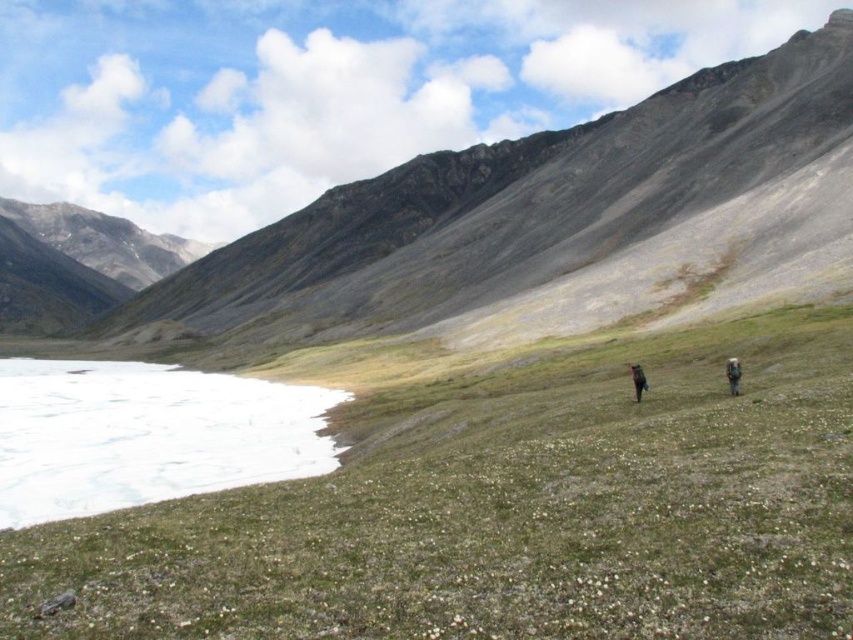
Question: Can you confirm if dark gray backpack at right is positioned to the left of brown fabric backpack at center-right?

Choices:
 (A) no
 (B) yes

Answer: (A)

Question: Which object is positioned farthest from the white ice at lower left?

Choices:
 (A) brown fabric backpack at center-right
 (B) dark gray backpack at right

Answer: (B)

Question: Can you confirm if white ice at lower left is thinner than brown fabric backpack at center-right?

Choices:
 (A) yes
 (B) no

Answer: (B)

Question: Does white ice at lower left have a larger size compared to brown fabric backpack at center-right?

Choices:
 (A) yes
 (B) no

Answer: (A)

Question: Which object is closer to the camera taking this photo?

Choices:
 (A) brown fabric backpack at center-right
 (B) white ice at lower left

Answer: (B)

Question: Estimate the real-world distances between objects in this image. Which object is closer to the brown fabric backpack at center-right?

Choices:
 (A) dark gray backpack at right
 (B) white ice at lower left

Answer: (A)